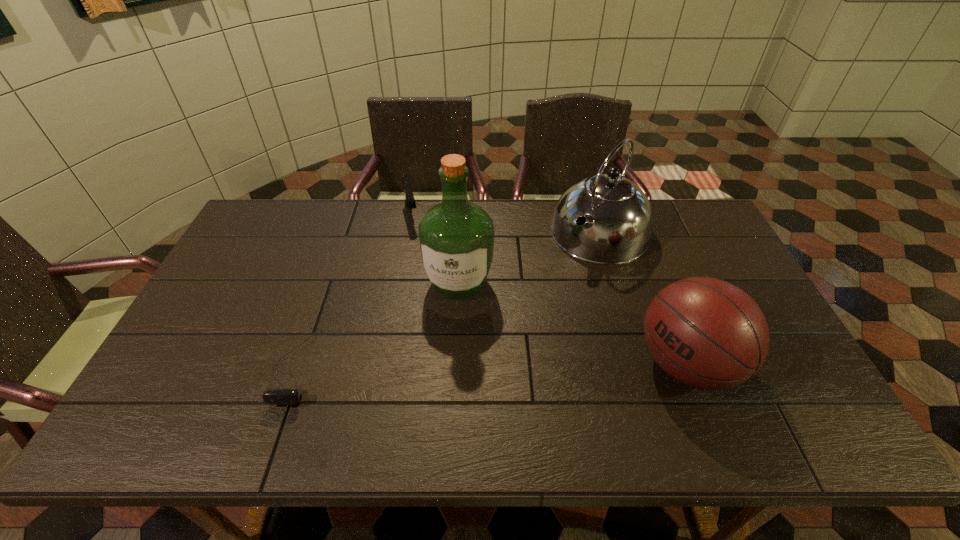
Find the location of a particular element. free spot on the desktop that is between the shortest object and the basketball and is positioned on the front-facing side of the liquor is located at coordinates pyautogui.click(x=445, y=364).

Image resolution: width=960 pixels, height=540 pixels. I want to click on vacant space on the desktop that is between the webcam and the basketball and is positioned from the spout of the kettle, so click(480, 364).

Image resolution: width=960 pixels, height=540 pixels. I want to click on free spot on the desktop that is between the shortest object and the basketball and is positioned on the front-facing side of the pistol, so click(x=454, y=364).